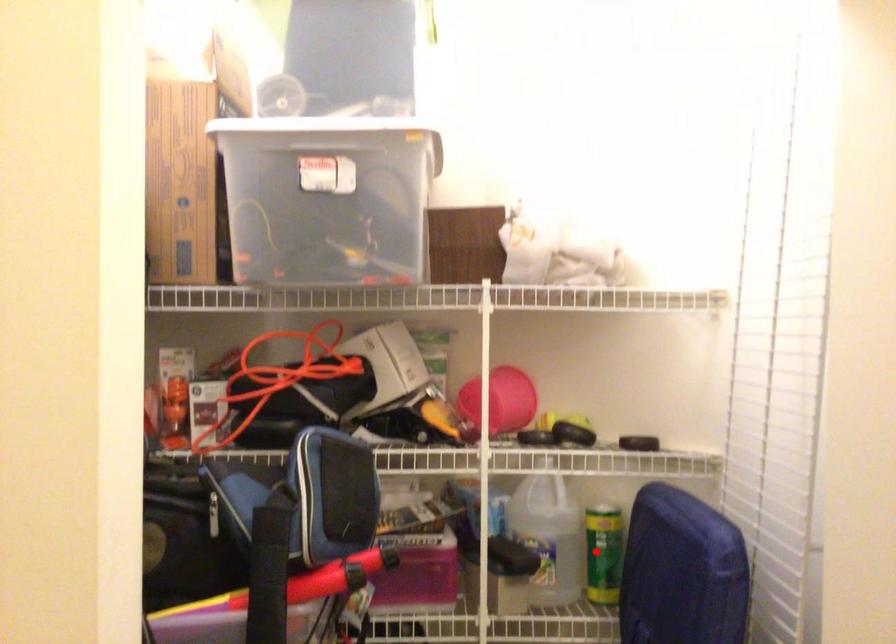
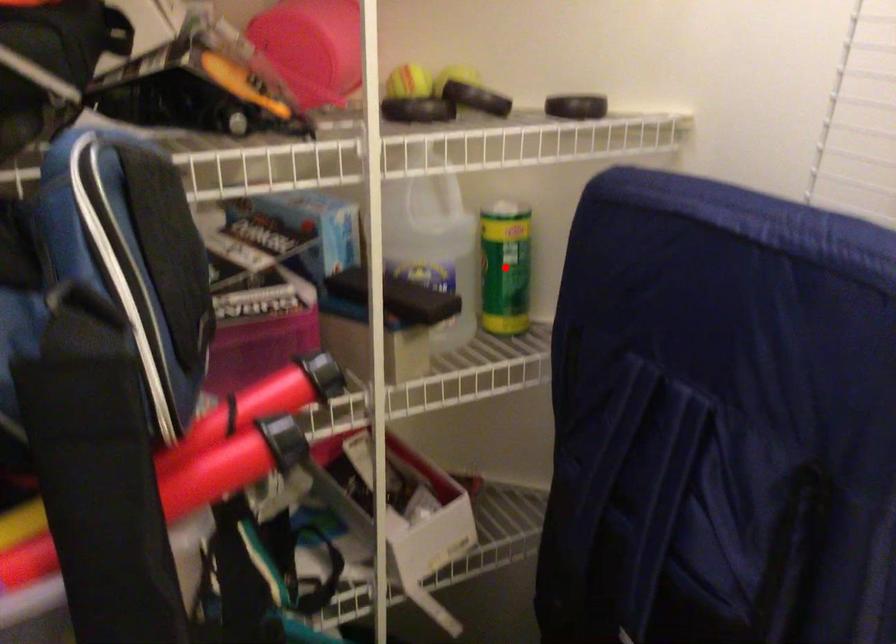
Consider the image. I am providing you with two images of the same scene from different viewpoints. A red point is marked on the first image and another point is marked on the second image. Is the red point in image1 aligned with the point shown in image2?

Yes